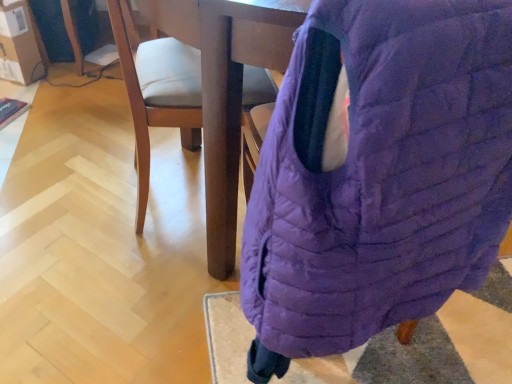
Locate an element on the screen. This screenshot has height=384, width=512. free location to the right of matte brown cardboard at upper left is located at coordinates (70, 83).